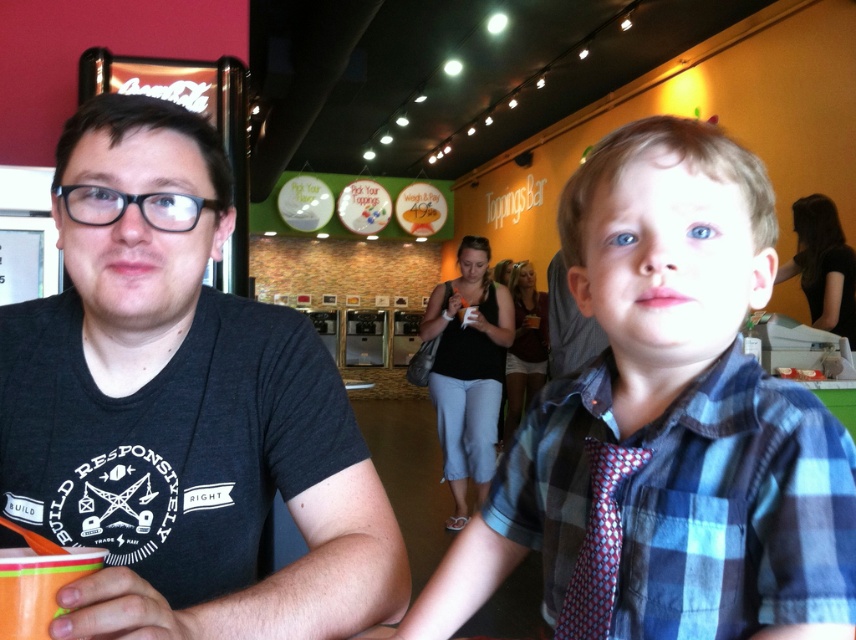
Question: Which is farther from the dark gray t-shirt at left?

Choices:
 (A) black cotton tank top at center
 (B) black shirt at upper right
 (C) matte maroon shirt at center

Answer: (C)

Question: Observing the image, what is the correct spatial positioning of black cotton tank top at center in reference to black shirt at upper right?

Choices:
 (A) right
 (B) left

Answer: (B)

Question: Is black shirt at upper right to the right of matte maroon shirt at center from the viewer's perspective?

Choices:
 (A) no
 (B) yes

Answer: (B)

Question: Among these points, which one is farthest from the camera?

Choices:
 (A) (224, 166)
 (B) (563, 442)

Answer: (A)

Question: Is blue plaid shirt at center bigger than black shirt at upper right?

Choices:
 (A) yes
 (B) no

Answer: (B)

Question: Which object is positioned closest to the blue plaid shirt at right?

Choices:
 (A) blue plaid shirt at center
 (B) black shirt at upper right
 (C) black cotton tank top at center

Answer: (A)